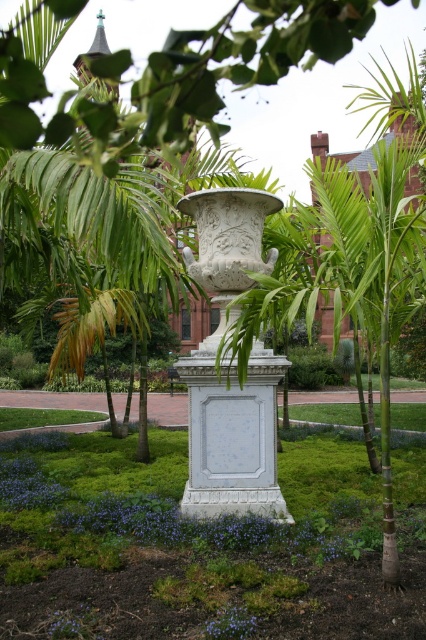
Is the position of purple matte flower at lower left more distant than that of purple matte flower at center?

No.

Between purple matte flower at lower left and purple matte flower at center, which one is positioned lower?

purple matte flower at lower left is lower down.

Between point (46, 628) and point (229, 636), which one is positioned behind?

The point (46, 628) is more distant.

At what (x,y) coordinates should I click in order to perform the action: click on purple matte flower at lower left. Please return your answer as a coordinate pair (x, y). The height and width of the screenshot is (640, 426). Looking at the image, I should click on (74, 625).